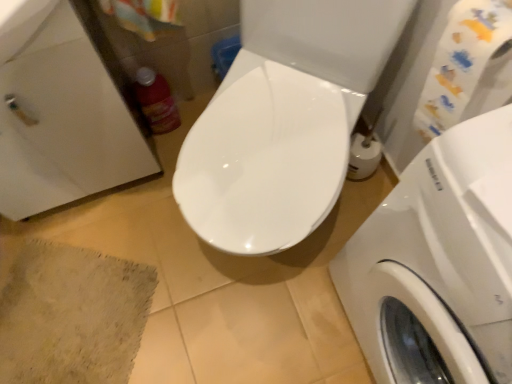
Question: In terms of size, does white glossy washing machine at right appear bigger or smaller than matte plastic bottle at left?

Choices:
 (A) small
 (B) big

Answer: (B)

Question: Does point 482,157 appear closer or farther from the camera than point 155,110?

Choices:
 (A) farther
 (B) closer

Answer: (B)

Question: Considering the real-world distances, which object is farthest from the matte plastic bottle at left?

Choices:
 (A) beige textured bath mat at lower left
 (B) white glossy sink at upper left
 (C) white glossy washing machine at right

Answer: (C)

Question: Which is nearer to the white glossy sink at upper left?

Choices:
 (A) matte plastic bottle at left
 (B) beige textured bath mat at lower left
 (C) white glossy washing machine at right

Answer: (A)